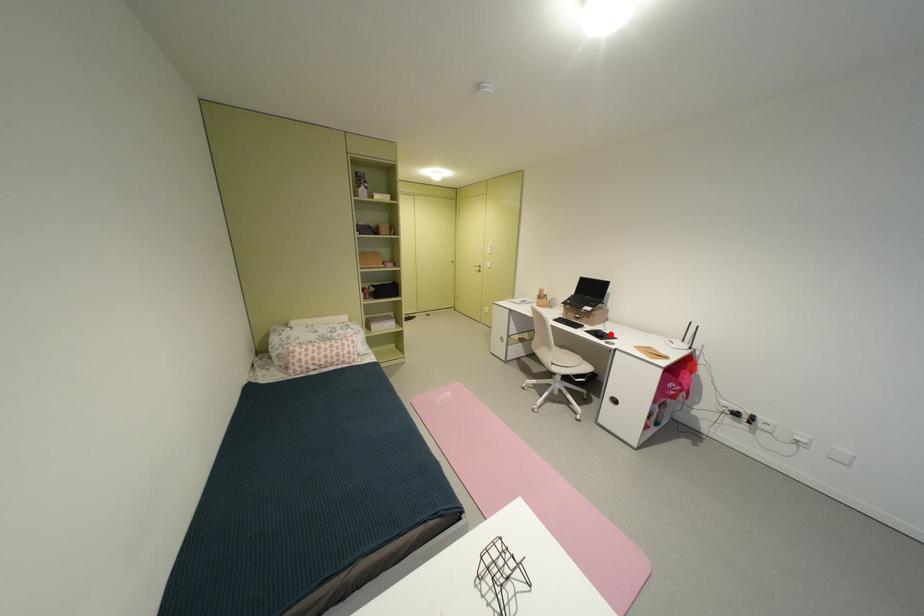
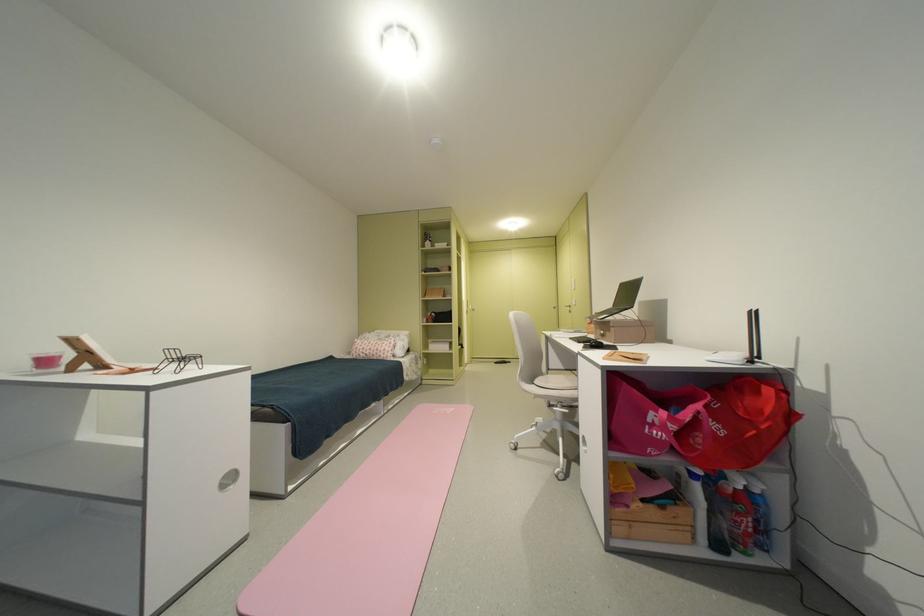
The point at the highlighted location is marked in the first image. Where is the corresponding point in the second image?

(602, 342)